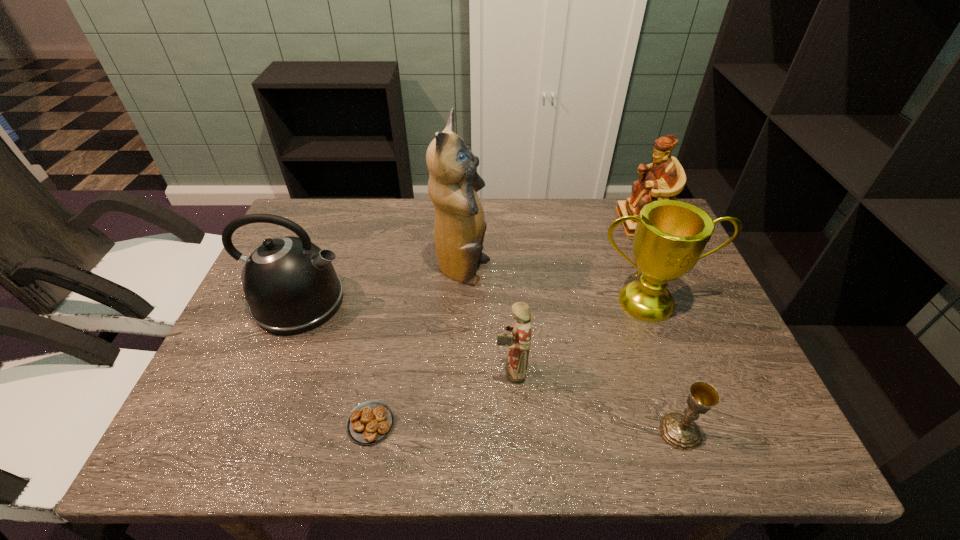
Locate an element on the screen. Image resolution: width=960 pixels, height=540 pixels. the fifth object from right to left is located at coordinates (459, 229).

You are a GUI agent. You are given a task and a screenshot of the screen. Output one action in this format:
    pyautogui.click(x=<x>, y=<y>)
    Task: Click on the cat
    
    Given the screenshot: What is the action you would take?
    pyautogui.click(x=459, y=229)

Where is `the farthest object`? This screenshot has height=540, width=960. the farthest object is located at coordinates (665, 178).

Locate an element on the screen. The height and width of the screenshot is (540, 960). the farther figurine is located at coordinates (665, 178).

This screenshot has height=540, width=960. I want to click on the leftmost object, so click(x=290, y=284).

At what (x,y) coordinates should I click in order to perform the action: click on award. Please return your answer as a coordinate pair (x, y). The width and height of the screenshot is (960, 540). Looking at the image, I should click on (670, 237).

Image resolution: width=960 pixels, height=540 pixels. Find the location of `the fourth object from left to right`. the fourth object from left to right is located at coordinates (518, 342).

Where is `the shorter figurine`? This screenshot has width=960, height=540. the shorter figurine is located at coordinates (518, 342).

The height and width of the screenshot is (540, 960). I want to click on the sixth tallest object, so click(680, 431).

You are a GUI agent. You are given a task and a screenshot of the screen. Output one action in this format:
    pyautogui.click(x=<x>, y=<y>)
    Task: Click on the sixth object from right to left
    This screenshot has height=540, width=960.
    Given the screenshot: What is the action you would take?
    pyautogui.click(x=370, y=422)